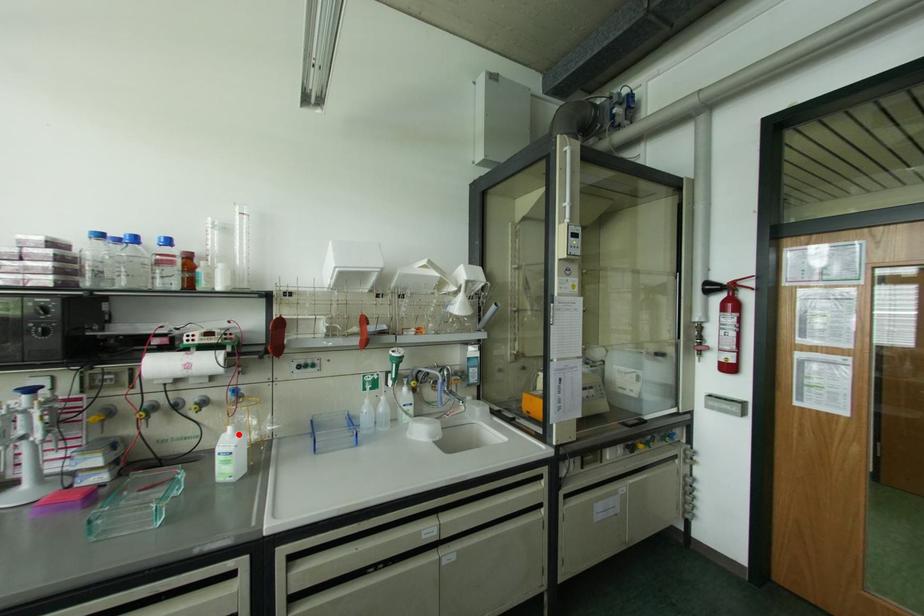
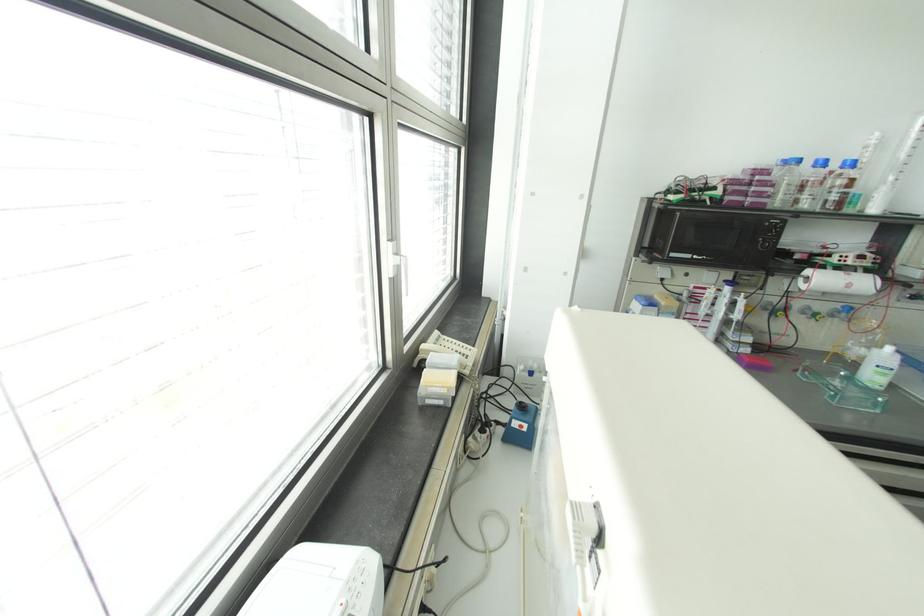
Locate, in the second image, the point that corresponds to the highlighted location in the first image.

(898, 355)